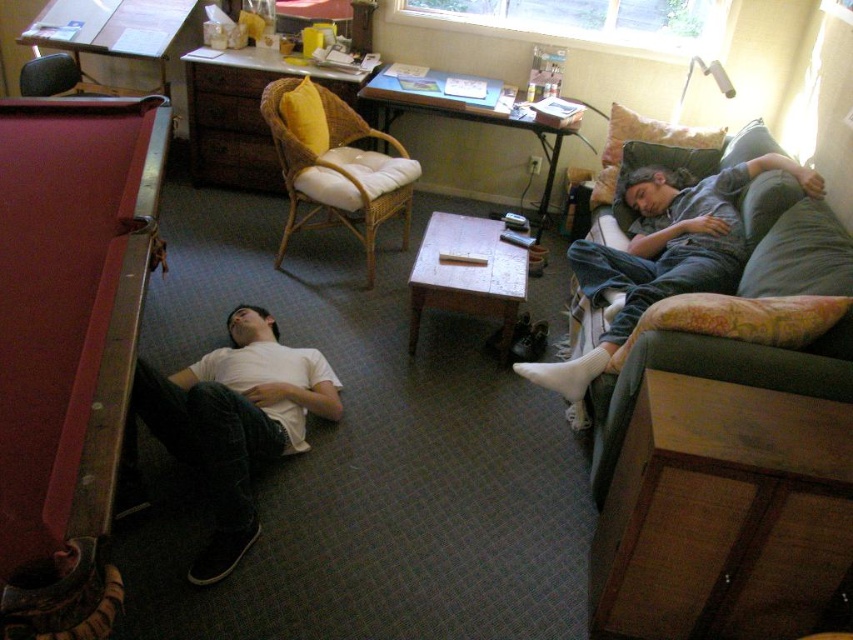
Question: Can you confirm if white matte t-shirt at lower left is positioned to the right of woven wicker chair with white cushion at center?

Choices:
 (A) yes
 (B) no

Answer: (B)

Question: Is maroon felt pool table at left to the left of white matte t-shirt at lower left from the viewer's perspective?

Choices:
 (A) no
 (B) yes

Answer: (B)

Question: Which object is closer to the camera taking this photo?

Choices:
 (A) white matte t-shirt at lower left
 (B) gray cotton pants at right
 (C) woven wicker chair with white cushion at center

Answer: (A)

Question: Which object is closer to the camera taking this photo?

Choices:
 (A) matte black chair at upper left
 (B) gray cotton pants at right
 (C) woven wicker chair with white cushion at center

Answer: (B)

Question: Which of the following is the farthest from the observer?

Choices:
 (A) woven wicker chair with white cushion at center
 (B) gray cotton pants at right

Answer: (A)

Question: Does maroon felt pool table at left have a smaller size compared to matte black chair at upper left?

Choices:
 (A) no
 (B) yes

Answer: (A)